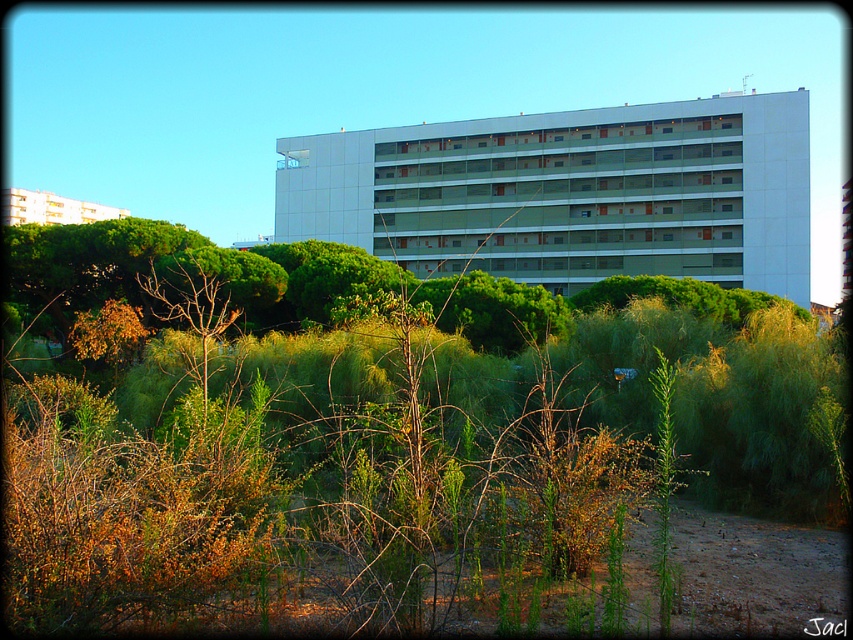
You are an architect analyzing the layout of the buildings in the image. Which building, the white smooth building at center or the white glossy building at upper left, occupies more horizontal space?

The white glossy building at upper left is wider than the white smooth building at center, so it occupies more horizontal space.

You are a drone operator tasked with flying a drone between the white smooth building at center and the white glossy building at upper left. The drone has a maximum flight distance of 50 meters. Can the drone safely complete this task without exceeding its range?

The white smooth building at center is 52.05 meters from the white glossy building at upper left. Since the drone has a maximum flight distance of 50 meters, it cannot safely complete the task as the distance exceeds its range.

You are standing at the origin point of the coordinate system. Looking at the image, where is the white smooth building at center located in terms of coordinates?

The white smooth building at center is located at coordinates point [570,193].